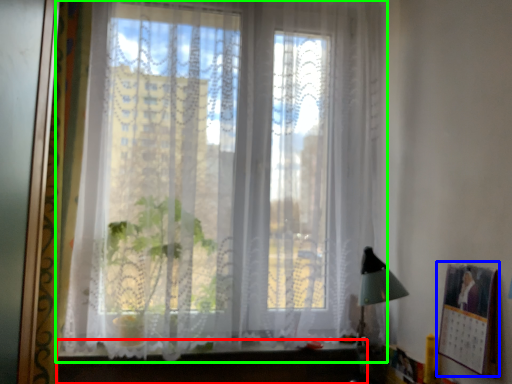
Question: Considering the real-world distances, which object is closest to vanity (highlighted by a red box)? picture frame (highlighted by a blue box) or window (highlighted by a green box).

Choices:
 (A) picture frame
 (B) window

Answer: (B)